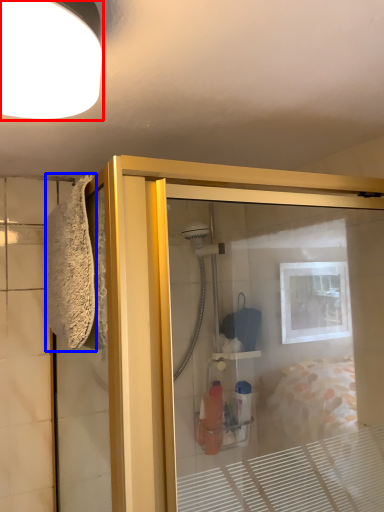
Question: Among these objects, which one is nearest to the camera, light fixture (highlighted by a red box) or bath towel (highlighted by a blue box)?

Choices:
 (A) light fixture
 (B) bath towel

Answer: (A)